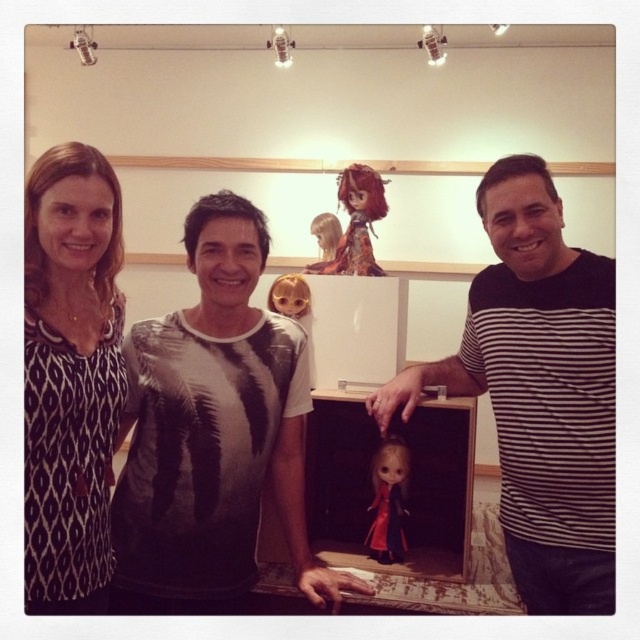
Can you confirm if printed cotton t-shirt at center is positioned below black striped shirt at right?

Yes.

This screenshot has height=640, width=640. Describe the element at coordinates (212, 433) in the screenshot. I see `printed cotton t-shirt at center` at that location.

Is point (196, 220) positioned after point (515, 577)?

No, it is not.

Find the location of a particular element. printed cotton t-shirt at center is located at coordinates (212, 433).

From the picture: Between black printed blouse at left and shiny brown hair doll at upper center, which one has more height?

black printed blouse at left

Is point (76, 371) positioned in front of point (369, 193)?

Yes, it is.

Is point (72, 339) closer to camera compared to point (358, 202)?

Yes, point (72, 339) is closer to viewer.

Locate an element on the screen. Image resolution: width=640 pixels, height=640 pixels. black printed blouse at left is located at coordinates (70, 376).

Does point (266, 372) lie in front of point (56, 483)?

No.

Can you confirm if printed cotton t-shirt at center is positioned above black printed blouse at left?

Incorrect, printed cotton t-shirt at center is not positioned above black printed blouse at left.

At what (x,y) coordinates should I click in order to perform the action: click on printed cotton t-shirt at center. Please return your answer as a coordinate pair (x, y). Looking at the image, I should click on (212, 433).